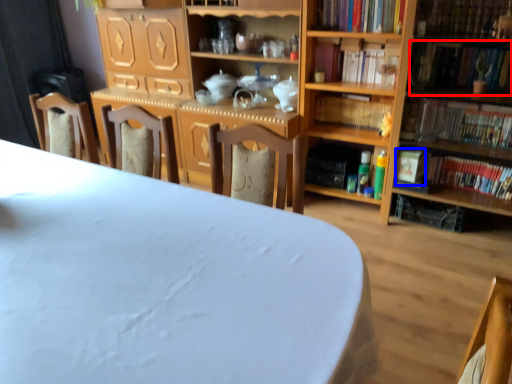
Question: Which object appears farthest to the camera in this image, book (highlighted by a red box) or paperback book (highlighted by a blue box)?

Choices:
 (A) book
 (B) paperback book

Answer: (B)